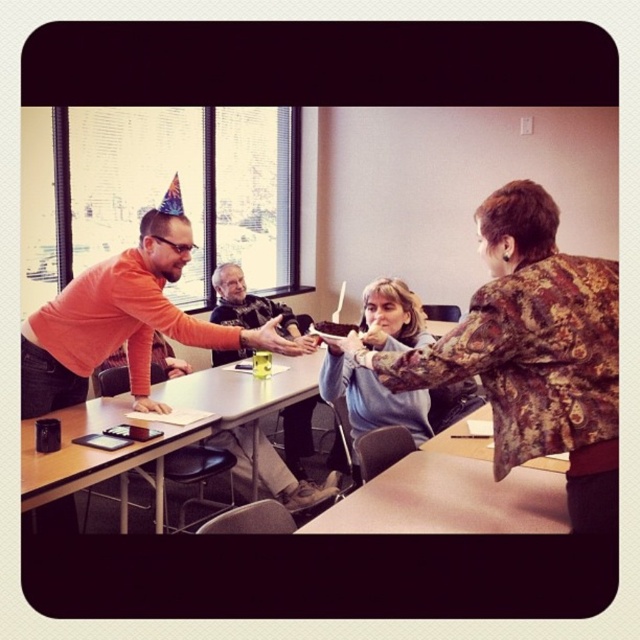
You are organizing a small event in the conference room and need to place a black leather jacket at center on top of the black plastic table at lower left. Will the table be able to accommodate the jacket without it hanging off the edges?

The black plastic table at lower left is larger in size than the black leather jacket at center, so yes, the table can accommodate the jacket without it hanging off the edges.

You are organizing a coat rack for guests in this conference room. You notice the light blue sweater at center and the black leather jacket at center. Which item should you hang first to ensure proper placement?

The light blue sweater at center is below the black leather jacket at center, so you should hang the black leather jacket at center first to place it above the sweater.